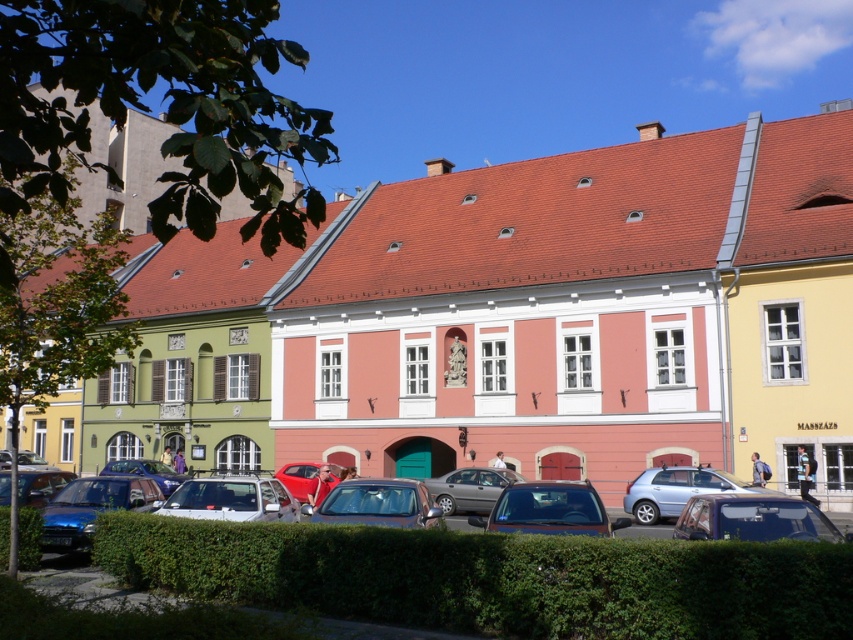
Question: Considering the real-world distances, which object is closest to the silver metallic sedan at center?

Choices:
 (A) green leafy hedge at lower center
 (B) metallic blue car at lower left
 (C) silver metallic suv at center
 (D) silver metallic hatchback at lower center

Answer: (C)

Question: Which object is the farthest from the silver metallic hatchback at lower center?

Choices:
 (A) green leafy hedge at lower center
 (B) metallic silver car at lower right
 (C) metallic silver car at lower left
 (D) silver metallic suv at center

Answer: (D)

Question: Which object is the closest to the metallic blue car at lower left?

Choices:
 (A) metallic blue sedan at center
 (B) green leafy hedge at lower left

Answer: (B)

Question: Does silver metallic hatchback at lower center appear over metallic silver car at lower left?

Choices:
 (A) no
 (B) yes

Answer: (B)

Question: Considering the relative positions of green leafy hedge at lower center and silver metallic suv at center in the image provided, where is green leafy hedge at lower center located with respect to silver metallic suv at center?

Choices:
 (A) above
 (B) below

Answer: (A)

Question: In this image, where is metallic silver car at lower right located relative to metallic silver car at lower left?

Choices:
 (A) left
 (B) right

Answer: (B)